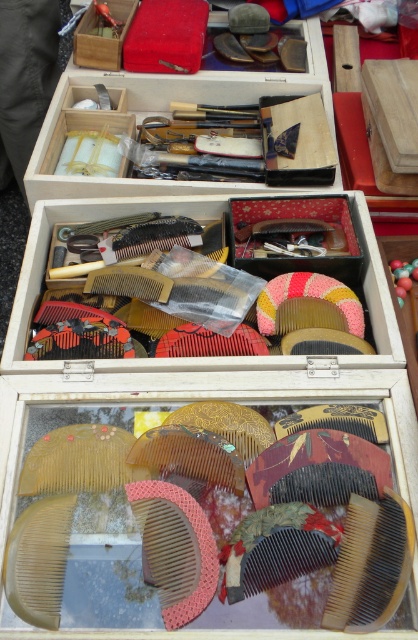
Based on the photo, you are a collector who wants to place a new comb between the brown wooden comb at center and the translucent amber comb at lower left. Can you fit it if the new comb is 15 inches long?

The distance between the brown wooden comb at center and the translucent amber comb at lower left is 16.69 inches. Since the new comb is 15 inches long, it can fit within the space provided.

You are a collector examining the vintage combs displayed in wooden boxes. You notice the translucent plastic combs at center and want to know their exact position relative to the other items in the scene. Can you determine their coordinates?

The translucent plastic combs at center are located at coordinates point (196, 358) according to the provided description.

You are a collector who wants to inspect the translucent plastic combs at center. You are currently standing 30 inches away from them. Can you reach them without moving closer?

The distance between the translucent plastic combs at center and the viewer is 30.55 inches. Since you are 30 inches away, you are slightly farther than the required distance to reach them, so you need to move 0.55 inches closer to inspect them.